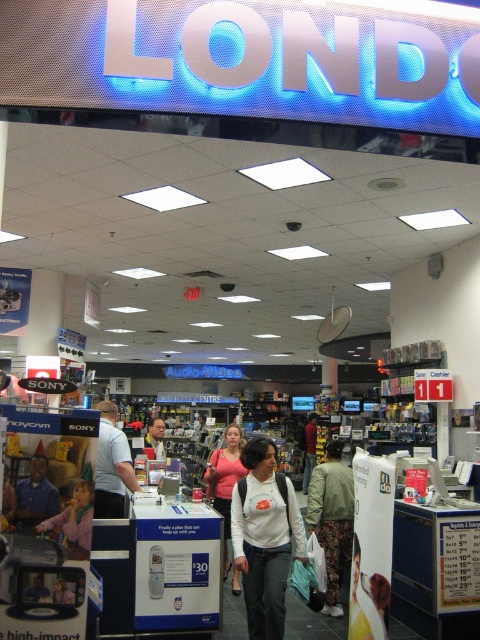
Can you confirm if matte blue shirt at lower left is positioned to the right of smooth skin face at center?

Yes, matte blue shirt at lower left is to the right of smooth skin face at center.

Does matte blue shirt at lower left have a greater width compared to smooth skin face at center?

No.

The image size is (480, 640). What do you see at coordinates (35, 497) in the screenshot?
I see `matte blue shirt at lower left` at bounding box center [35, 497].

Where is `matte blue shirt at lower left`? Image resolution: width=480 pixels, height=640 pixels. matte blue shirt at lower left is located at coordinates (35, 497).

Locate an element on the screen. This screenshot has width=480, height=640. floral-patterned pants at center is located at coordinates (332, 518).

Can you confirm if floral-patterned pants at center is smaller than pink fabric shirt at center?

Incorrect, floral-patterned pants at center is not smaller in size than pink fabric shirt at center.

Is point (337, 474) less distant than point (245, 470)?

Yes, point (337, 474) is in front of point (245, 470).

Find the location of a particular element. The height and width of the screenshot is (640, 480). floral-patterned pants at center is located at coordinates (332, 518).

Is point (337, 560) closer to viewer compared to point (36, 474)?

No, it is behind (36, 474).

Is point (331, 588) farther from camera compared to point (35, 465)?

Yes, it is.

Identify the location of floral-patterned pants at center. This screenshot has height=640, width=480. (332, 518).